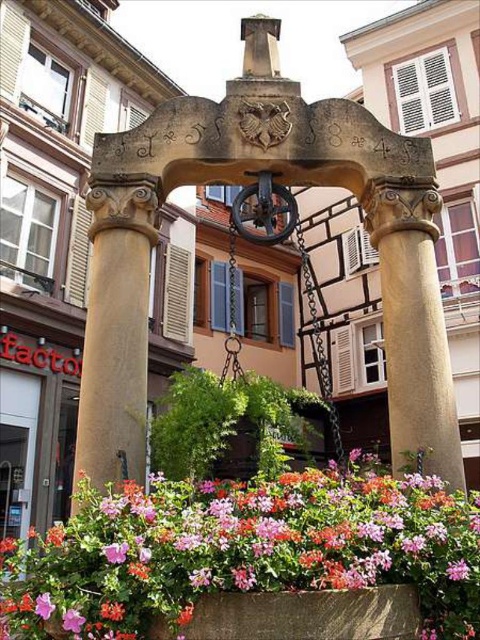
Does pink matte flower at center appear over matte stone flower box at lower center?

Yes, pink matte flower at center is above matte stone flower box at lower center.

Is pink matte flower at center wider than matte stone flower box at lower center?

Yes, pink matte flower at center is wider than matte stone flower box at lower center.

Who is more distant from viewer, (462,518) or (273,616)?

The point (462,518) is behind.

This screenshot has height=640, width=480. Identify the location of pink matte flower at center. (244, 550).

Who is lower down, brown stone column at left or matte stone flower box at lower center?

matte stone flower box at lower center is lower down.

Between point (96, 180) and point (377, 592), which one is positioned behind?

The point (96, 180) is more distant.

Is point (94, 307) less distant than point (211, 618)?

That is False.

I want to click on brown stone column at left, so click(117, 332).

Between pink matte flower at center and brown stone column at left, which one has less height?

pink matte flower at center

Between point (443, 582) and point (128, 330), which one is positioned in front?

Point (443, 582) is in front.

Who is more distant from viewer, (336, 480) or (115, 339)?

Positioned behind is point (115, 339).

What are the coordinates of `pink matte flower at center` in the screenshot? It's located at (244, 550).